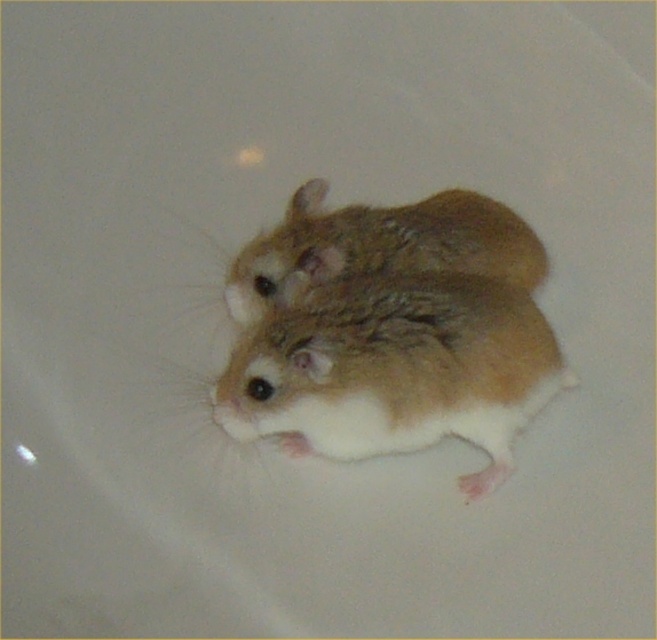
Question: Observing the image, what is the correct spatial positioning of fuzzy brown mouse at center in reference to fuzzy brown hamster at center?

Choices:
 (A) right
 (B) left

Answer: (A)

Question: Which point is closer to the camera taking this photo?

Choices:
 (A) (365, 227)
 (B) (547, 394)

Answer: (B)

Question: From the image, what is the correct spatial relationship of fuzzy brown mouse at center in relation to fuzzy brown hamster at center?

Choices:
 (A) right
 (B) left

Answer: (A)

Question: Which of the following is the closest to the observer?

Choices:
 (A) click(510, 371)
 (B) click(306, 189)

Answer: (A)

Question: Which object is farther from the camera taking this photo?

Choices:
 (A) fuzzy brown hamster at center
 (B) fuzzy brown mouse at center

Answer: (A)

Question: Is fuzzy brown mouse at center further to camera compared to fuzzy brown hamster at center?

Choices:
 (A) no
 (B) yes

Answer: (A)